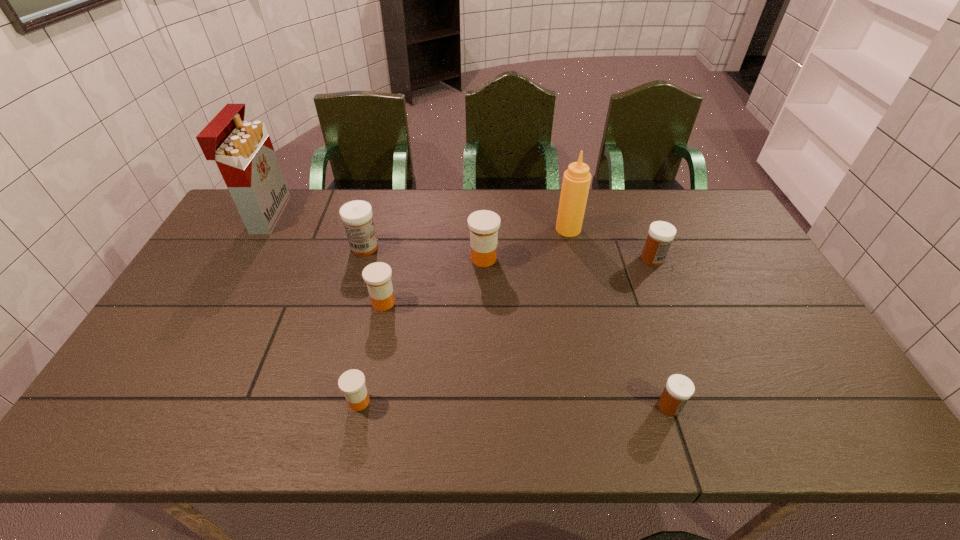
What are the coordinates of `free spot located 0.340m on the front of the leftmost medicine` in the screenshot? It's located at (337, 347).

I want to click on free space located on the label of the second biggest orange medicine, so click(458, 302).

This screenshot has height=540, width=960. Find the location of `free space located on the right of the second smallest white medicine`. free space located on the right of the second smallest white medicine is located at coordinates (752, 259).

At what (x,y) coordinates should I click in order to perform the action: click on blank space located on the left of the smallest white medicine. Please return your answer as a coordinate pair (x, y). Looking at the image, I should click on (636, 406).

Find the location of `vacant space located on the label of the nearest orange medicine`. vacant space located on the label of the nearest orange medicine is located at coordinates (505, 402).

Where is `cigarette case that is at the far edge`? This screenshot has height=540, width=960. cigarette case that is at the far edge is located at coordinates (243, 151).

Locate an element on the screen. condiment that is at the far edge is located at coordinates (576, 180).

Find the location of a particular element. The height and width of the screenshot is (540, 960). object at the left edge is located at coordinates coord(243,151).

I want to click on object present at the far left corner, so click(x=243, y=151).

Where is `vacant area at the far edge of the desktop`? vacant area at the far edge of the desktop is located at coordinates (293, 204).